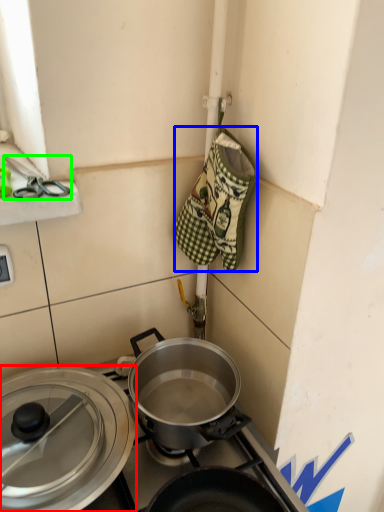
Question: Which object is positioned closest to pot/pan (highlighted by a red box)? Select from material (highlighted by a blue box) and scissors (highlighted by a green box).

Choices:
 (A) material
 (B) scissors

Answer: (A)